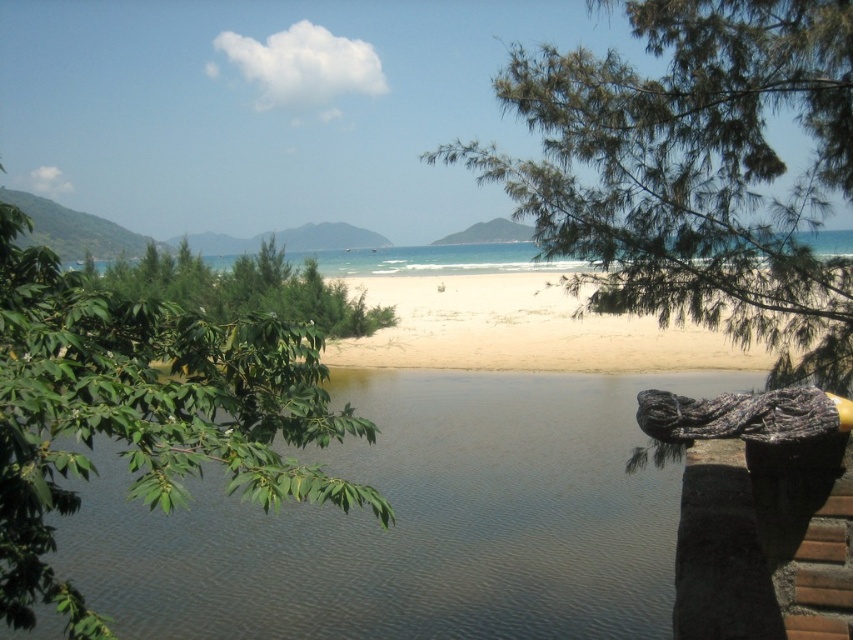
Question: Does green needle-like leaves at center have a greater width compared to green leafy tree at left?

Choices:
 (A) no
 (B) yes

Answer: (B)

Question: Based on their relative distances, which object is farther from the green leafy tree at left?

Choices:
 (A) green leafy tree at center
 (B) green needle-like leaves at center

Answer: (A)

Question: Which point appears closest to the camera in this image?

Choices:
 (A) (236, 300)
 (B) (415, 285)

Answer: (A)

Question: Does white sandy beach at center have a greater width compared to green leafy tree at center?

Choices:
 (A) no
 (B) yes

Answer: (A)

Question: Is green leafy tree at left to the left of white sandy beach at center from the viewer's perspective?

Choices:
 (A) yes
 (B) no

Answer: (A)

Question: Which object appears closest to the camera in this image?

Choices:
 (A) green leafy tree at center
 (B) white sandy beach at center
 (C) green needle-like leaves at center
 (D) green leafy tree at left

Answer: (D)